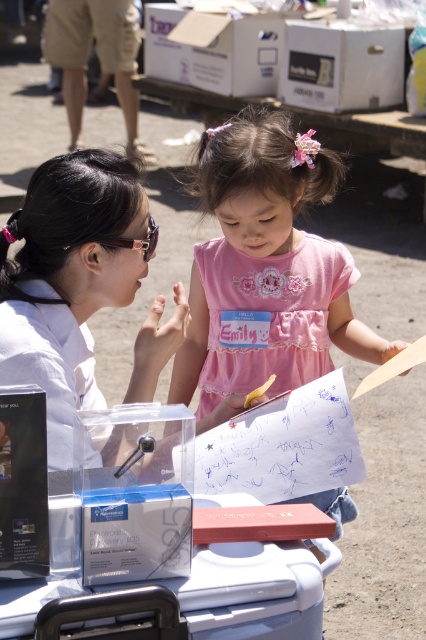
Question: Does pink satin dress at center appear under matte black goggles at upper left?

Choices:
 (A) no
 (B) yes

Answer: (B)

Question: Which point is closer to the camera taking this photo?

Choices:
 (A) (244, 234)
 (B) (123, 240)

Answer: (B)

Question: Can you confirm if pink satin dress at center is positioned to the left of matte black goggles at upper left?

Choices:
 (A) no
 (B) yes

Answer: (A)

Question: Which of the following is the closest to the observer?

Choices:
 (A) pink satin dress at center
 (B) matte black goggles at upper left

Answer: (B)

Question: In this image, where is pink satin dress at center located relative to matte black goggles at upper left?

Choices:
 (A) below
 (B) above

Answer: (A)